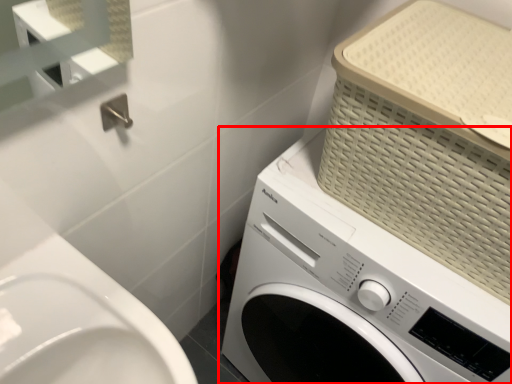
Question: From the image, what is the correct spatial relationship of washing machine (annotated by the red box) in relation to basket?

Choices:
 (A) right
 (B) left

Answer: (B)